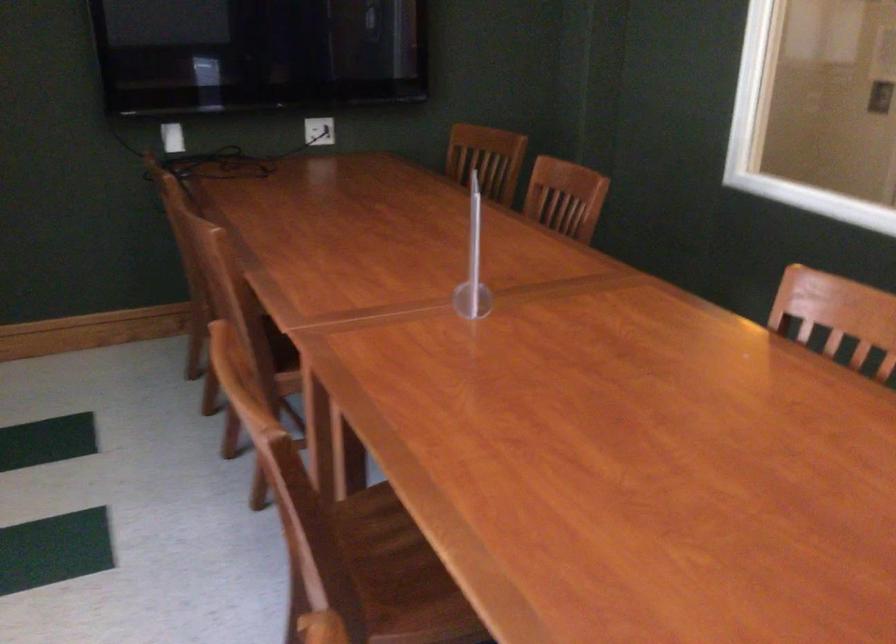
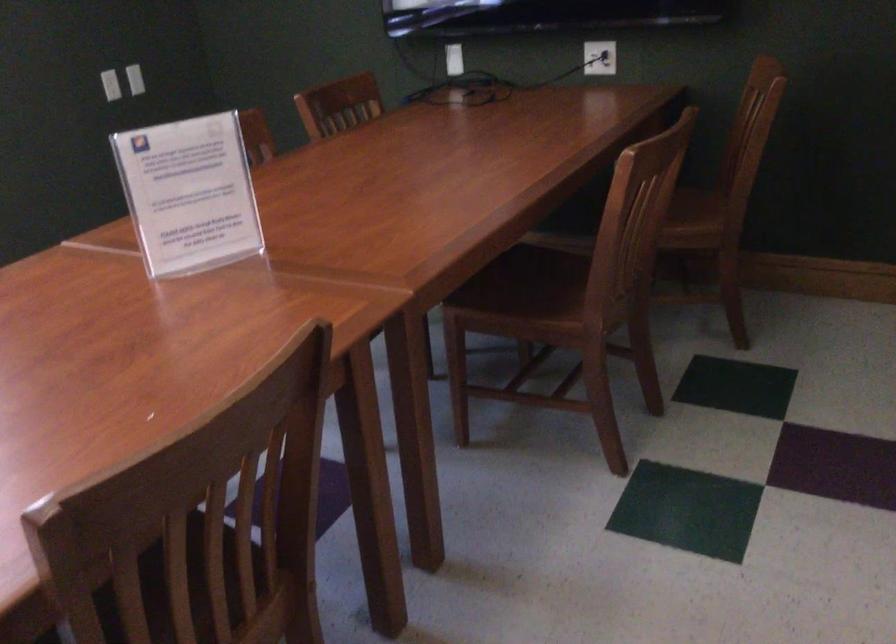
Find the pixel in the second image that matches point (538, 219) in the first image.

(668, 205)